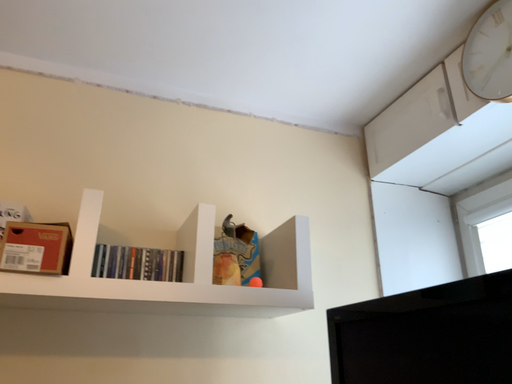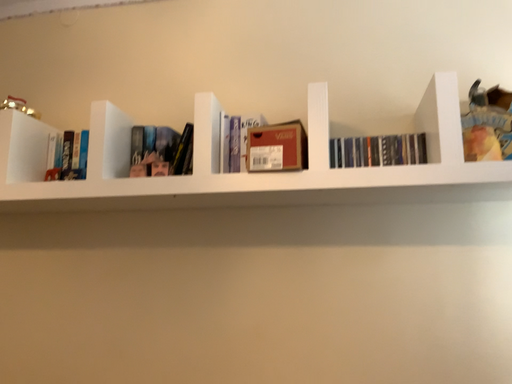
Question: How did the camera likely rotate when shooting the video?

Choices:
 (A) rotated upward
 (B) rotated downward

Answer: (B)